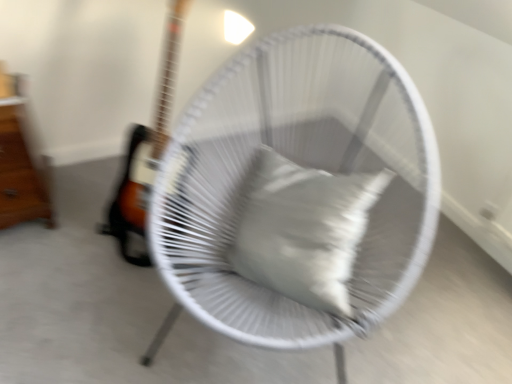
What is the approximate width of white woven chair at center?

white woven chair at center is 31.44 inches wide.

In order to face white matte pillow at center, should I rotate leftwards or rightwards?

Rotate right and turn 5.625 degrees.

Where is `white woven chair at center`? The image size is (512, 384). white woven chair at center is located at coordinates [x=304, y=166].

Based on the photo, is wooden drawer at left to the left of white woven chair at center from the viewer's perspective?

Correct, you'll find wooden drawer at left to the left of white woven chair at center.

Is wooden drawer at left turned away from white woven chair at center?

No, wooden drawer at left is not facing the opposite direction of white woven chair at center.

Between point (7, 174) and point (400, 146), which one is positioned behind?

Point (7, 174)

Is the position of wooden drawer at left more distant than that of white woven chair at center?

Yes, it is.

Which object is closer to the camera, white woven chair at center or white matte pillow at center?

Positioned in front is white woven chair at center.

From the image's perspective, is white woven chair at center on white matte pillow at center?

Yes, from the image's perspective, white woven chair at center is over white matte pillow at center.

How distant is white woven chair at center from white matte pillow at center?

white woven chair at center is 5.80 inches from white matte pillow at center.

Is white woven chair at center shorter than white matte pillow at center?

In fact, white woven chair at center may be taller than white matte pillow at center.

From a real-world perspective, is white woven chair at center located beneath wooden drawer at left?

Incorrect, from a real-world perspective, white woven chair at center is higher than wooden drawer at left.

Which of these two, white woven chair at center or wooden drawer at left, is bigger?

With larger size is white woven chair at center.

Between white woven chair at center and wooden drawer at left, which one has more height?

white woven chair at center.

Measure the distance from white woven chair at center to wooden drawer at left.

white woven chair at center is 36.69 inches away from wooden drawer at left.

Is white matte pillow at center taller than wooden drawer at left?

No, white matte pillow at center is not taller than wooden drawer at left.

Is white matte pillow at center positioned with its back to wooden drawer at left?

No, white matte pillow at center is not facing away from wooden drawer at left.

From the image's perspective, is white matte pillow at center below wooden drawer at left?

Yes, from the image's perspective, white matte pillow at center is beneath wooden drawer at left.

Does point (262, 199) come behind point (17, 81)?

That is False.

Which point is more forward, [342,205] or [213,112]?

The point [342,205] is in front.

From a real-world perspective, is white matte pillow at center above or below white woven chair at center?

In terms of real-world spatial position, white matte pillow at center is above white woven chair at center.

From the picture: Can you tell me how much white matte pillow at center and white woven chair at center differ in facing direction?

white matte pillow at center and white woven chair at center are facing 11.2 degrees away from each other.

Is the surface of wooden drawer at left in direct contact with white matte pillow at center?

There is a gap between wooden drawer at left and white matte pillow at center.

How much distance is there between wooden drawer at left and white matte pillow at center?

wooden drawer at left is 1.04 meters away from white matte pillow at center.

The width and height of the screenshot is (512, 384). Identify the location of pillow that is in front of the wooden drawer at left. (303, 230).

What are the coordinates of `mechanical fan that appears on the right of wooden drawer at left` in the screenshot? It's located at (304, 166).

Image resolution: width=512 pixels, height=384 pixels. Find the location of `pillow behind the white woven chair at center`. pillow behind the white woven chair at center is located at coordinates (303, 230).

Estimate the real-world distances between objects in this image. Which object is further from white woven chair at center, white matte pillow at center or wooden drawer at left?

wooden drawer at left.

Based on their spatial positions, is wooden drawer at left or white woven chair at center further from white matte pillow at center?

wooden drawer at left.

Considering their positions, is white woven chair at center positioned closer to white matte pillow at center than wooden drawer at left?

white woven chair at center.

Which object lies nearer to the anchor point wooden drawer at left, white woven chair at center or white matte pillow at center?

The object closer to wooden drawer at left is white woven chair at center.

Considering their positions, is white matte pillow at center positioned further to wooden drawer at left than white woven chair at center?

The object further to wooden drawer at left is white matte pillow at center.

In the scene shown: From the image, which object appears to be farther from white woven chair at center, wooden drawer at left or white matte pillow at center?

Among the two, wooden drawer at left is located further to white woven chair at center.

Find the location of `mechanical fan located between wooden drawer at left and white matte pillow at center in the left-right direction`. mechanical fan located between wooden drawer at left and white matte pillow at center in the left-right direction is located at coordinates (304, 166).